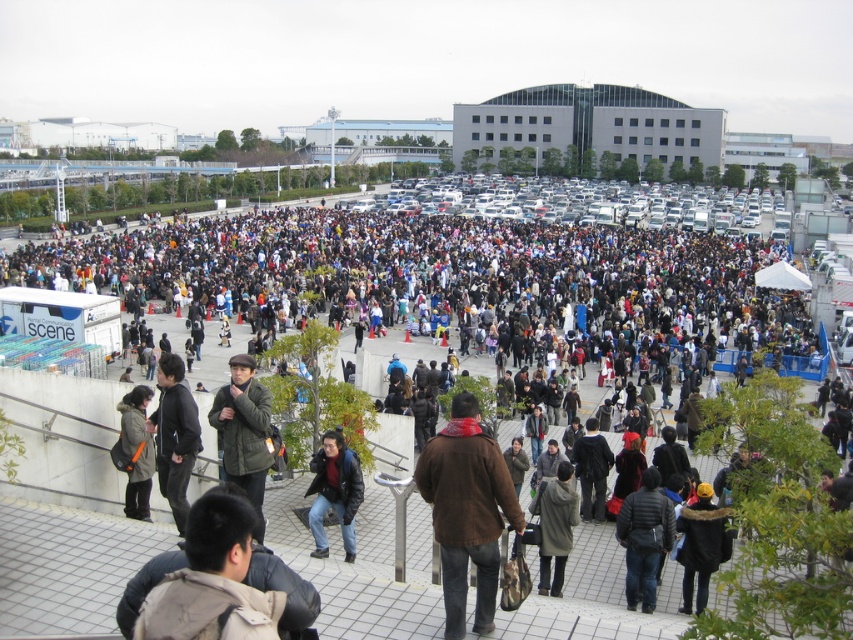
Question: Which of the following is the farthest from the observer?

Choices:
 (A) click(x=758, y=435)
 (B) click(x=573, y=492)
 (C) click(x=136, y=460)

Answer: (A)

Question: Is black fur-trimmed coat at lower right positioned before orange fabric bag at lower left?

Choices:
 (A) yes
 (B) no

Answer: (A)

Question: Which point appears farthest from the camera in this image?

Choices:
 (A) click(676, 560)
 (B) click(143, 394)
 (C) click(271, 625)

Answer: (B)

Question: Is dark green textured jacket at center further to the viewer compared to leather jacket at lower center?

Choices:
 (A) yes
 (B) no

Answer: (B)

Question: Which point is farther to the camera?

Choices:
 (A) black fur-trimmed coat at lower right
 (B) dark brown leather jacket at center

Answer: (A)

Question: Can you confirm if dark gray jacket at lower center is wider than dark green jacket at center?

Choices:
 (A) yes
 (B) no

Answer: (A)